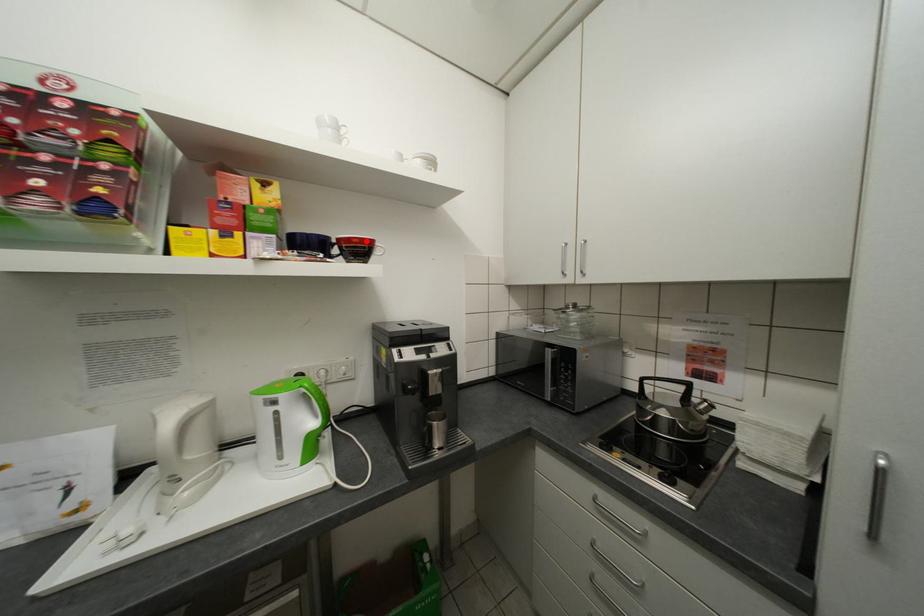
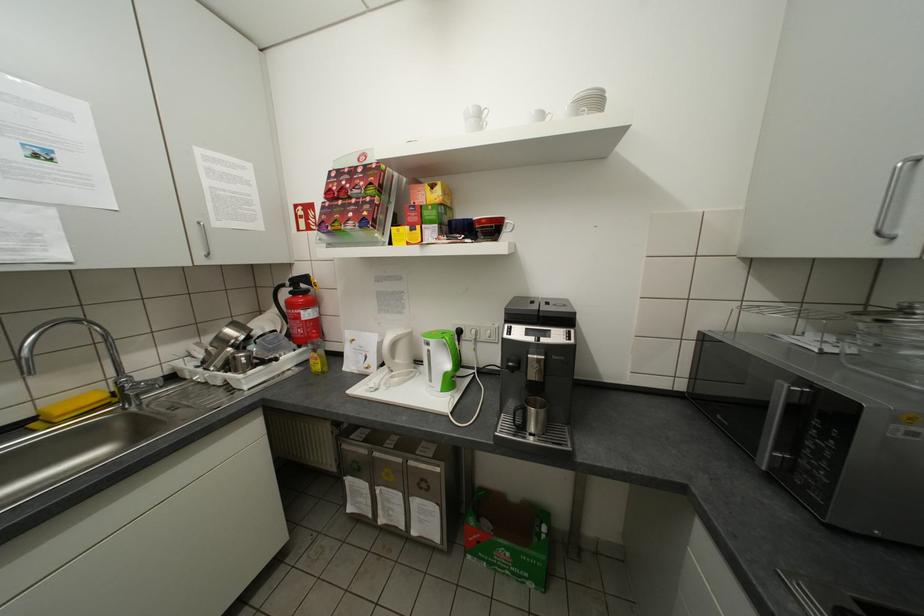
The point at the highlighted location is marked in the first image. Where is the corresponding point in the second image?

(494, 222)